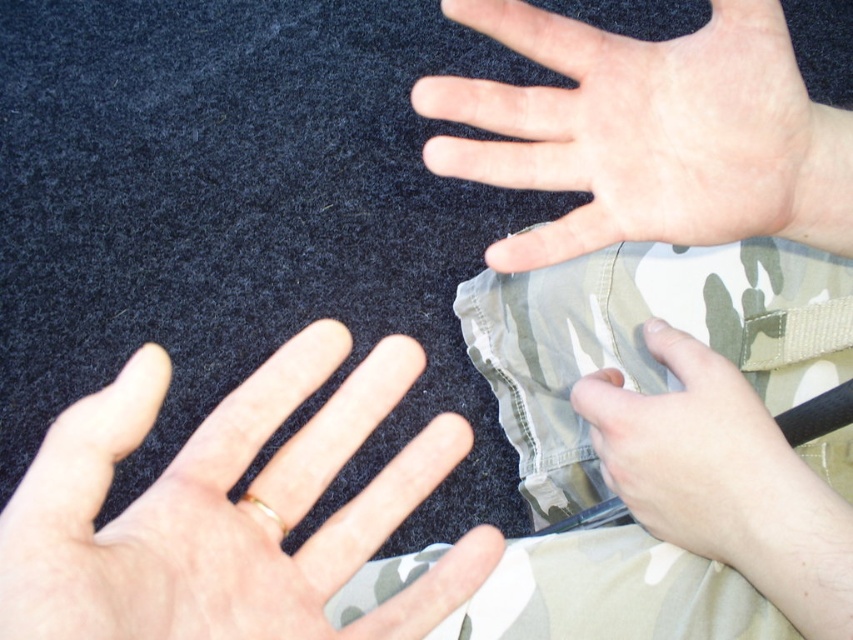
How much distance is there between smooth skin hand at lower left and camouflage fabric hand at lower right?

A distance of 7.27 inches exists between smooth skin hand at lower left and camouflage fabric hand at lower right.

Locate an element on the screen. Image resolution: width=853 pixels, height=640 pixels. smooth skin hand at lower left is located at coordinates pos(231,509).

I want to click on smooth skin hand at lower left, so click(x=231, y=509).

This screenshot has height=640, width=853. Identify the location of smooth skin hand at lower left. (231, 509).

Can you confirm if smooth skin hand at lower left is positioned to the left of camouflage fabric pants at center?

Indeed, smooth skin hand at lower left is positioned on the left side of camouflage fabric pants at center.

Can you confirm if smooth skin hand at lower left is positioned below camouflage fabric pants at center?

No.

The height and width of the screenshot is (640, 853). What do you see at coordinates (231, 509) in the screenshot?
I see `smooth skin hand at lower left` at bounding box center [231, 509].

Find the location of a particular element. This screenshot has width=853, height=640. smooth skin hand at lower left is located at coordinates (231, 509).

Is pale skin at center to the left of camouflage fabric hand at lower right from the viewer's perspective?

Indeed, pale skin at center is positioned on the left side of camouflage fabric hand at lower right.

At what (x,y) coordinates should I click in order to perform the action: click on pale skin at center. Please return your answer as a coordinate pair (x, y). Image resolution: width=853 pixels, height=640 pixels. Looking at the image, I should click on (639, 131).

I want to click on pale skin at center, so click(x=639, y=131).